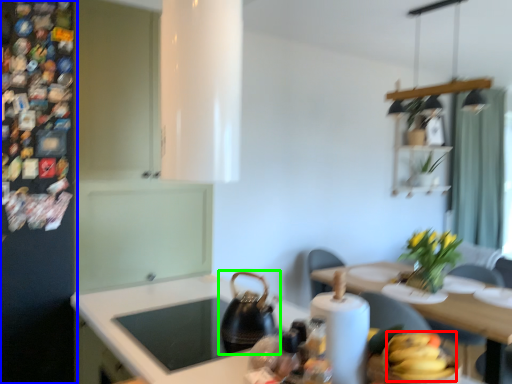
Question: Estimate the real-world distances between objects in this image. Which object is closer to banana (highlighted by a red box), fridge (highlighted by a blue box) or tea pot (highlighted by a green box)?

Choices:
 (A) fridge
 (B) tea pot

Answer: (B)